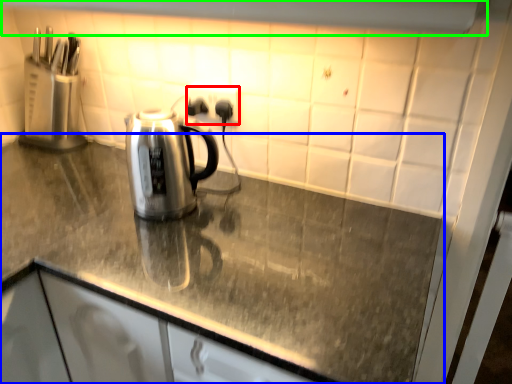
Question: Which object is positioned farthest from electric outlet (highlighted by a red box)? Select from countertop (highlighted by a blue box) and exhaust hood (highlighted by a green box).

Choices:
 (A) countertop
 (B) exhaust hood

Answer: (A)